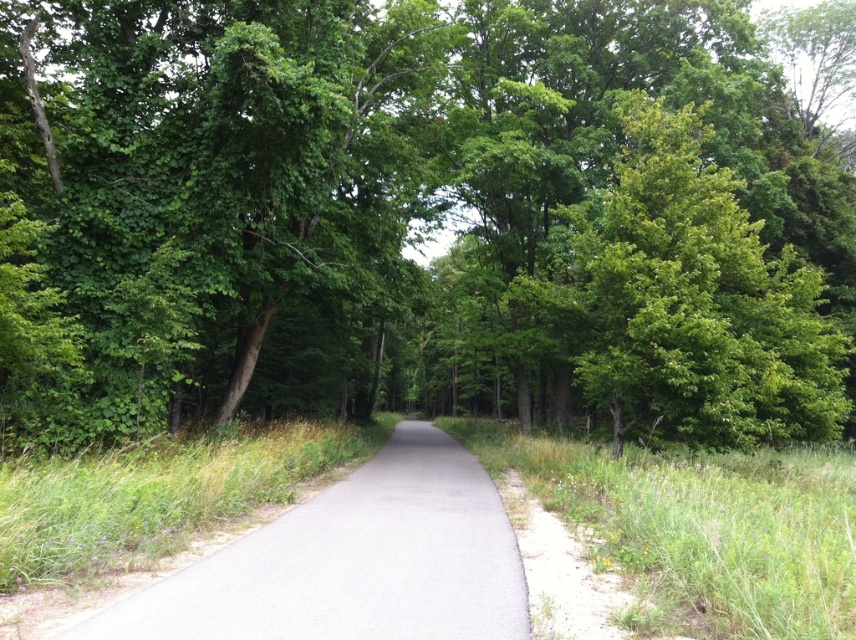
Who is more forward, (343, 337) or (660, 612)?

Point (660, 612)

Does green leafy tree at center have a greater width compared to green grass at right?

Yes.

Identify the location of green leafy tree at center. The image size is (856, 640). (426, 214).

What are the coordinates of `green leafy tree at center` in the screenshot? It's located at (426, 214).

Does gray asphalt path at center have a lesser height compared to green grass at right?

Yes, gray asphalt path at center is shorter than green grass at right.

Does gray asphalt path at center have a greater height compared to green grass at right?

No.

Does point (218, 620) lie in front of point (544, 460)?

That is True.

Locate an element on the screen. The height and width of the screenshot is (640, 856). gray asphalt path at center is located at coordinates (352, 563).

Does green leafy tree at center have a greater height compared to gray asphalt path at center?

Indeed, green leafy tree at center has a greater height compared to gray asphalt path at center.

Can you confirm if green leafy tree at center is wider than gray asphalt path at center?

Yes, green leafy tree at center is wider than gray asphalt path at center.

The height and width of the screenshot is (640, 856). What are the coordinates of `green leafy tree at center` in the screenshot? It's located at (426, 214).

I want to click on green leafy tree at center, so click(x=426, y=214).